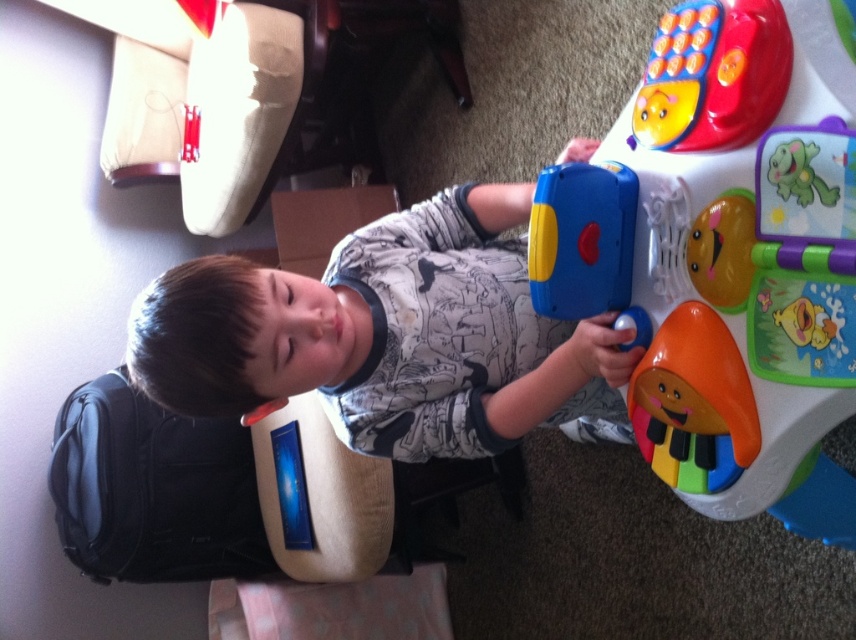
Question: Considering the relative positions of rubberized plastic toy at center right and matte plastic child at center in the image provided, where is rubberized plastic toy at center right located with respect to matte plastic child at center?

Choices:
 (A) below
 (B) above

Answer: (A)

Question: In this image, where is rubberized plastic toy at center right located relative to matte plastic child at center?

Choices:
 (A) right
 (B) left

Answer: (A)

Question: Which object is farther from the camera taking this photo?

Choices:
 (A) rubberized plastic toy at center right
 (B) matte plastic child at center

Answer: (B)

Question: Among these points, which one is nearest to the camera?

Choices:
 (A) (450, 236)
 (B) (795, 513)

Answer: (B)

Question: Which of the following is the closest to the observer?

Choices:
 (A) matte plastic child at center
 (B) rubberized plastic toy at center right

Answer: (B)

Question: Considering the relative positions of rubberized plastic toy at center right and matte plastic child at center in the image provided, where is rubberized plastic toy at center right located with respect to matte plastic child at center?

Choices:
 (A) right
 (B) left

Answer: (A)